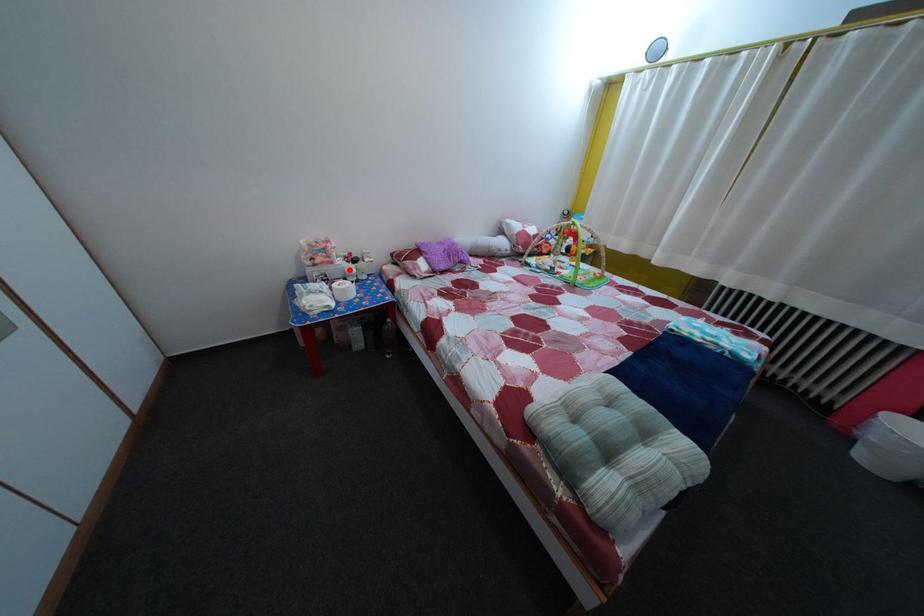
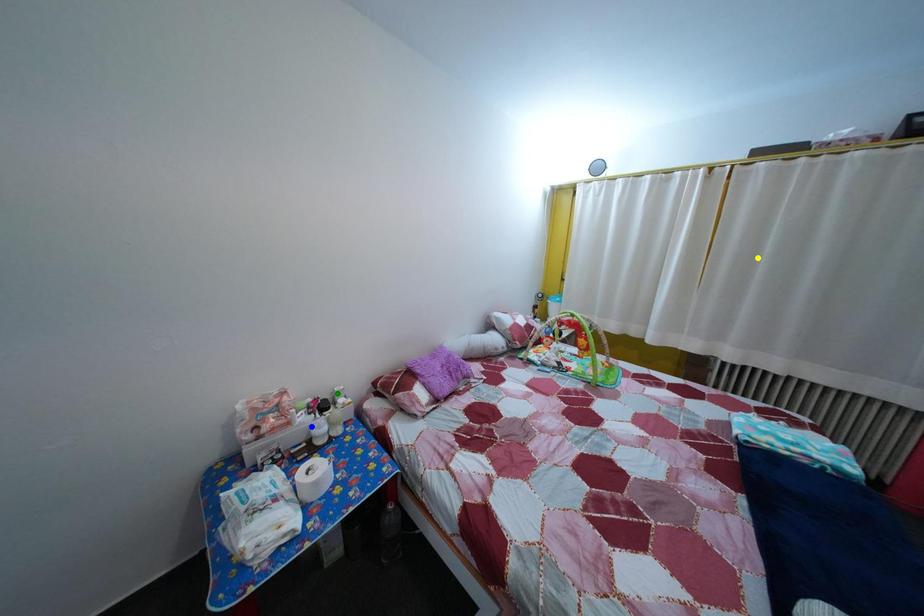
Question: I am providing you with two images of the same scene from different viewpoints. A red point is marked on the first image. You are given multiple points on the second image. Which point in image 2 is actually the same real-world point as the red point in image 1?

Choices:
 (A) blue point
 (B) yellow point
 (C) green point

Answer: (A)